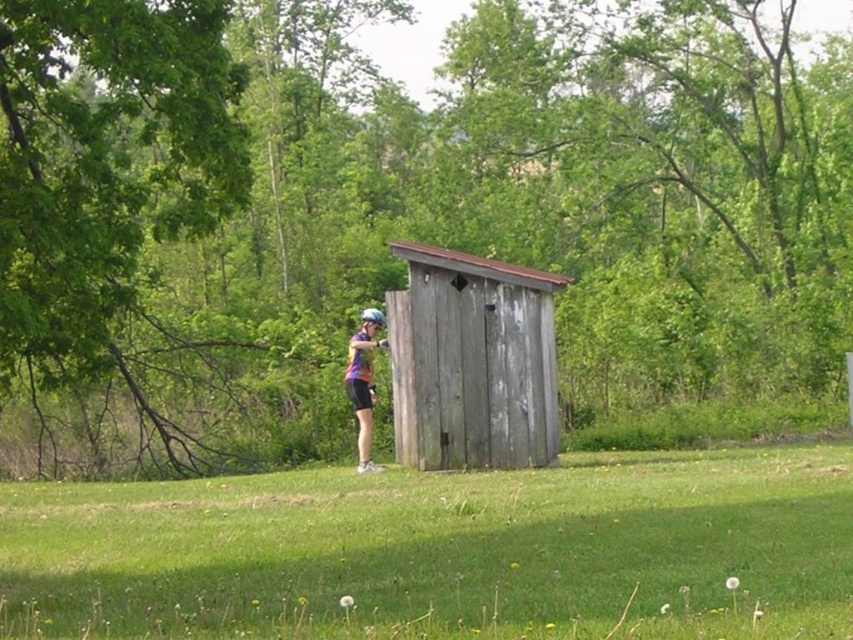
Question: Which point is closer to the camera?

Choices:
 (A) (527, 618)
 (B) (424, 424)
 (C) (268, 307)
 (D) (358, 368)

Answer: (A)

Question: Does weathered wood hut at center have a smaller size compared to purple fabric helmet at center?

Choices:
 (A) yes
 (B) no

Answer: (B)

Question: Which of the following is the closest to the observer?

Choices:
 (A) (355, 376)
 (B) (325, 109)
 (C) (488, 369)
 (D) (801, 618)

Answer: (D)

Question: Which of these objects is positioned closest to the green leafy tree at upper left?

Choices:
 (A) green grass at center
 (B) weathered wood hut at center
 (C) purple fabric helmet at center

Answer: (B)

Question: Can you confirm if weathered wood hut at center is bigger than purple fabric helmet at center?

Choices:
 (A) yes
 (B) no

Answer: (A)

Question: Can you confirm if green leafy tree at upper left is positioned to the right of purple fabric helmet at center?

Choices:
 (A) yes
 (B) no

Answer: (A)